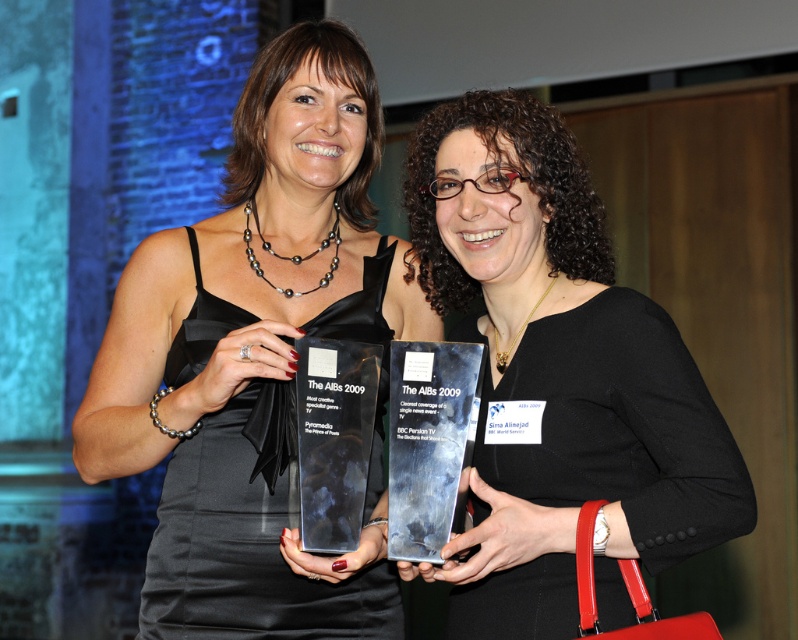
You are a photographer adjusting your camera settings to capture the two subjects in the scene. Which object, the satin black dress at center or the matte black award at center, will require more careful lighting adjustments due to its reflective surface?

The satin black dress at center requires more careful lighting adjustments because it has a reflective surface, unlike the matte black award at center.

Looking at this image, you are a photographer trying to capture a clear shot of both the satin black dress at center and the matte black award at center. Since both are in the center, which one will appear larger in the photo?

The satin black dress at center is much taller than the matte black award at center, so it will appear larger in the photo.

You are a photographer adjusting your camera settings to focus on two points in the image. The first point is point (293, 285) and the second point is point (688, 492). Which point is closer to the camera?

Point (293, 285) is closer to the camera than point (688, 492).